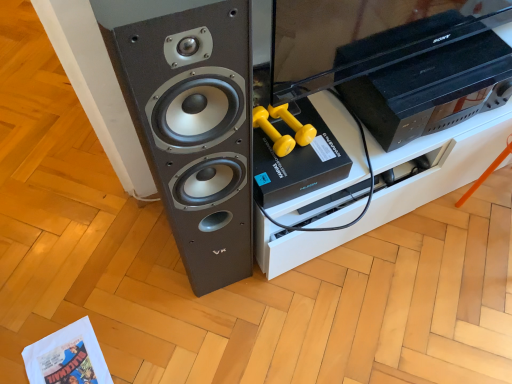
Where is `matte black speaker at left`? This screenshot has width=512, height=384. matte black speaker at left is located at coordinates (192, 123).

What do you see at coordinates (428, 89) in the screenshot? I see `black plastic sony tv at upper right` at bounding box center [428, 89].

In order to face black plastic tv stand at center, should I rotate leftwards or rightwards?

To align with it, rotate right about 18.190°.

Find the location of a particular element. Image resolution: width=512 pixels, height=384 pixels. matte black speaker at left is located at coordinates (192, 123).

Considering the sizes of black plastic sony tv at upper right and black plastic tv stand at center in the image, is black plastic sony tv at upper right taller or shorter than black plastic tv stand at center?

Clearly, black plastic sony tv at upper right is shorter compared to black plastic tv stand at center.

Is black plastic sony tv at upper right wider or thinner than black plastic tv stand at center?

Clearly, black plastic sony tv at upper right has less width compared to black plastic tv stand at center.

Is the surface of black plastic sony tv at upper right in direct contact with black plastic tv stand at center?

No.

From the image's perspective, which one is positioned lower, black plastic sony tv at upper right or black plastic tv stand at center?

black plastic tv stand at center.

Can you confirm if black plastic tv stand at center is taller than black plastic sony tv at upper right?

Correct, black plastic tv stand at center is much taller as black plastic sony tv at upper right.

Locate an element on the screen. This screenshot has width=512, height=384. furniture below the black plastic sony tv at upper right (from the image's perspective) is located at coordinates (396, 187).

Considering the sizes of black plastic tv stand at center and black plastic sony tv at upper right in the image, is black plastic tv stand at center wider or thinner than black plastic sony tv at upper right?

In the image, black plastic tv stand at center appears to be wider than black plastic sony tv at upper right.

Which of these two, matte black speaker at left or black plastic sony tv at upper right, is bigger?

matte black speaker at left.

From the picture: Is matte black speaker at left shorter than black plastic sony tv at upper right?

No, matte black speaker at left is not shorter than black plastic sony tv at upper right.

Which is in front, matte black speaker at left or black plastic sony tv at upper right?

matte black speaker at left is more forward.

Between black plastic sony tv at upper right and matte black speaker at left, which one has larger width?

Wider between the two is matte black speaker at left.

From the image's perspective, is black plastic sony tv at upper right located above matte black speaker at left?

Correct, black plastic sony tv at upper right appears higher than matte black speaker at left in the image.

Can we say black plastic sony tv at upper right lies outside matte black speaker at left?

Yes.

Measure the distance between black plastic sony tv at upper right and matte black speaker at left.

black plastic sony tv at upper right is 21.63 inches from matte black speaker at left.

Is point (134, 35) behind point (367, 223)?

No, (134, 35) is in front of (367, 223).

From a real-world perspective, is matte black speaker at left physically below black plastic tv stand at center?

No, from a real-world perspective, matte black speaker at left is not under black plastic tv stand at center.

Is the surface of matte black speaker at left in direct contact with black plastic tv stand at center?

No, matte black speaker at left is not beside black plastic tv stand at center.

Can you tell me how much matte black speaker at left and black plastic tv stand at center differ in facing direction?

The angle between the facing direction of matte black speaker at left and the facing direction of black plastic tv stand at center is 5.02 degrees.

From the image's perspective, is black plastic tv stand at center located above matte black speaker at left?

Yes, from the image's perspective, black plastic tv stand at center is over matte black speaker at left.

Is black plastic tv stand at center wider or thinner than matte black speaker at left?

In the image, black plastic tv stand at center appears to be wider than matte black speaker at left.

Does point (283, 253) come closer to viewer compared to point (144, 137)?

That is False.

Where is `home appliance above the black plastic tv stand at center (from the image's perspective)`? home appliance above the black plastic tv stand at center (from the image's perspective) is located at coordinates [x=428, y=89].

Locate an element on the screen. The width and height of the screenshot is (512, 384). furniture below the black plastic sony tv at upper right (from a real-world perspective) is located at coordinates (396, 187).

In the scene shown: Based on their spatial positions, is black plastic sony tv at upper right or matte black speaker at left further from black plastic tv stand at center?

matte black speaker at left is positioned further to the anchor black plastic tv stand at center.

Considering their positions, is matte black speaker at left positioned further to black plastic sony tv at upper right than black plastic tv stand at center?

matte black speaker at left is further to black plastic sony tv at upper right.

Considering their positions, is black plastic sony tv at upper right positioned further to matte black speaker at left than black plastic tv stand at center?

Among the two, black plastic sony tv at upper right is located further to matte black speaker at left.

Looking at the image, which one is located further to matte black speaker at left, black plastic tv stand at center or black plastic sony tv at upper right?

The object further to matte black speaker at left is black plastic sony tv at upper right.

In the scene shown: Which object lies nearer to the anchor point black plastic tv stand at center, matte black speaker at left or black plastic sony tv at upper right?

black plastic sony tv at upper right.

Which object lies nearer to the anchor point black plastic sony tv at upper right, black plastic tv stand at center or matte black speaker at left?

black plastic tv stand at center is positioned closer to the anchor black plastic sony tv at upper right.

Locate an element on the screen. Image resolution: width=512 pixels, height=384 pixels. furniture located between matte black speaker at left and black plastic sony tv at upper right in the left-right direction is located at coordinates (396, 187).